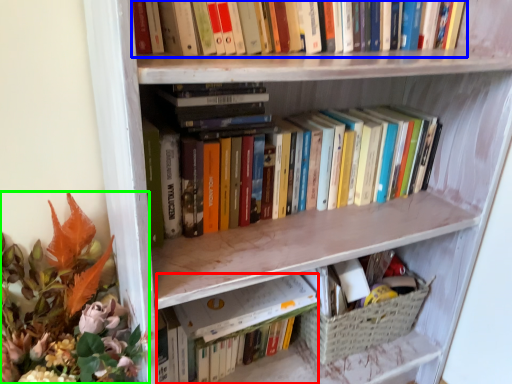
Question: Based on their relative distances, which object is farther from paperback book (highlighted by a red box)? Choose from book (highlighted by a blue box) and floral arrangement (highlighted by a green box).

Choices:
 (A) book
 (B) floral arrangement

Answer: (A)